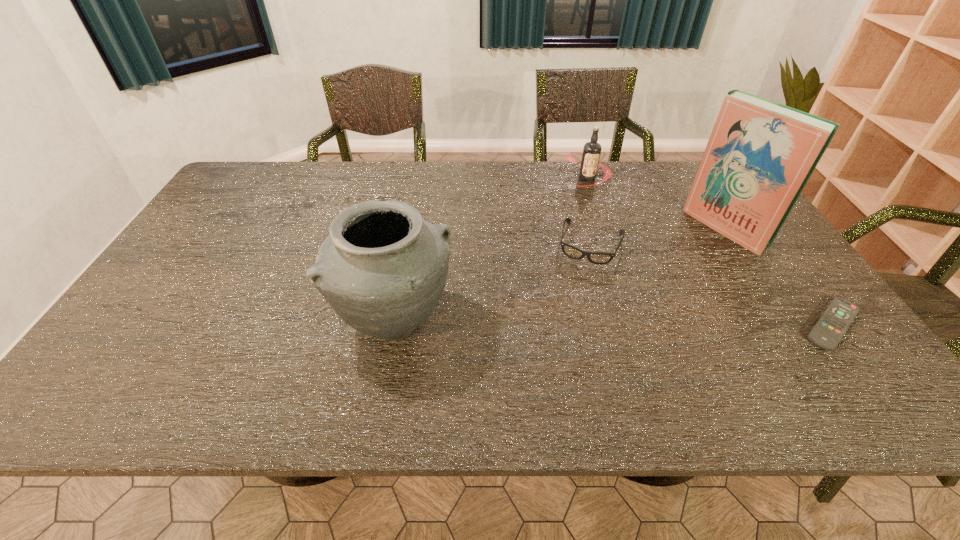
This screenshot has width=960, height=540. Identify the location of free location located 0.260m on the cover of the hardback book. (646, 280).

Locate an element on the screen. This screenshot has width=960, height=540. free space located 0.270m on the cover of the hardback book is located at coordinates pyautogui.click(x=643, y=282).

You are a GUI agent. You are given a task and a screenshot of the screen. Output one action in this format:
    pyautogui.click(x=<x>, y=<y>)
    Task: Click on the vacant area situated 0.180m on the front-facing side of the fourth tallest object
    The width and height of the screenshot is (960, 540).
    Given the screenshot: What is the action you would take?
    (x=571, y=315)

The width and height of the screenshot is (960, 540). Identify the location of vacant point located on the front-facing side of the fourth tallest object. (564, 336).

Find the location of a particular element. The image size is (960, 540). vacant region located on the front-facing side of the fourth tallest object is located at coordinates click(575, 300).

Locate an element on the screen. vacant space located on the label of the root beer is located at coordinates (573, 228).

Image resolution: width=960 pixels, height=540 pixels. What are the coordinates of `vacant area situated on the label of the root beer` in the screenshot? It's located at (570, 241).

The width and height of the screenshot is (960, 540). Find the location of `free spot located 0.180m on the label of the root beer`. free spot located 0.180m on the label of the root beer is located at coordinates (575, 221).

What are the coordinates of `object present at the far edge` in the screenshot? It's located at coord(591,153).

Locate an element on the screen. Image resolution: width=960 pixels, height=540 pixels. urn that is at the near edge is located at coordinates (382, 268).